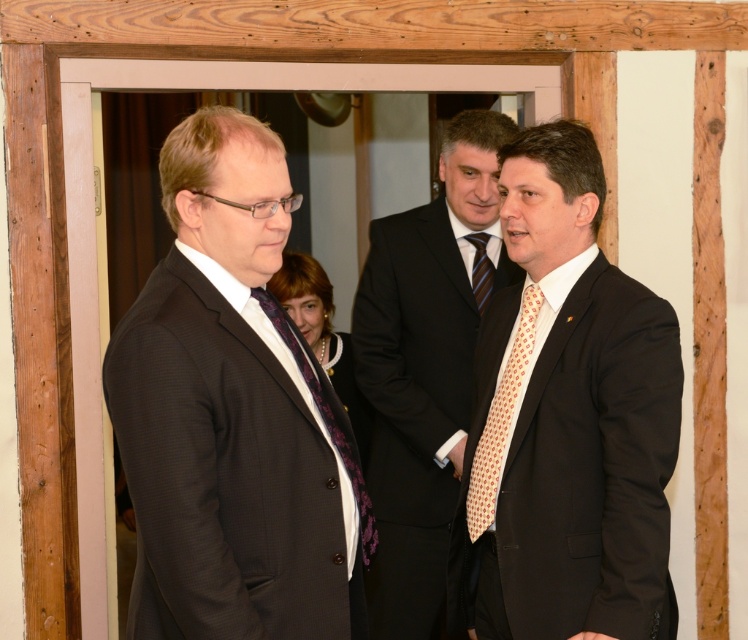
Question: Estimate the real-world distances between objects in this image. Which object is farther from the matte black suit at left?

Choices:
 (A) purple textured tie at center
 (B) polka dot tie at center
 (C) striped silk tie at center

Answer: (C)

Question: Can you confirm if matte black suit at center is smaller than striped silk tie at center?

Choices:
 (A) no
 (B) yes

Answer: (A)

Question: Is matte black suit at center thinner than purple textured tie at center?

Choices:
 (A) no
 (B) yes

Answer: (A)

Question: Is matte black suit at left above matte black suit at center?

Choices:
 (A) yes
 (B) no

Answer: (B)

Question: Estimate the real-world distances between objects in this image. Which object is farther from the light orange dotted tie at right?

Choices:
 (A) striped silk tie at center
 (B) polka dot tie at center
 (C) purple textured tie at center
 (D) matte black suit at center

Answer: (A)

Question: Based on their relative distances, which object is nearer to the matte black suit at center?

Choices:
 (A) light orange dotted tie at right
 (B) striped silk tie at center
 (C) matte black suit at left
 (D) purple textured tie at center

Answer: (B)